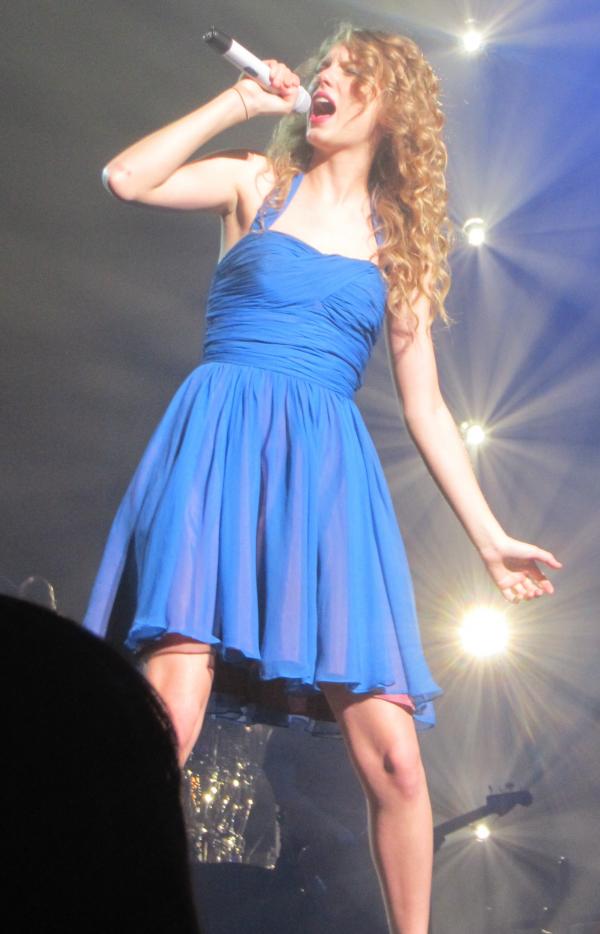
You are a GUI agent. You are given a task and a screenshot of the screen. Output one action in this format:
    pyautogui.click(x=<x>, y=<y>)
    Task: Click on the 1 mic
    
    Given the screenshot: What is the action you would take?
    pyautogui.click(x=235, y=67)